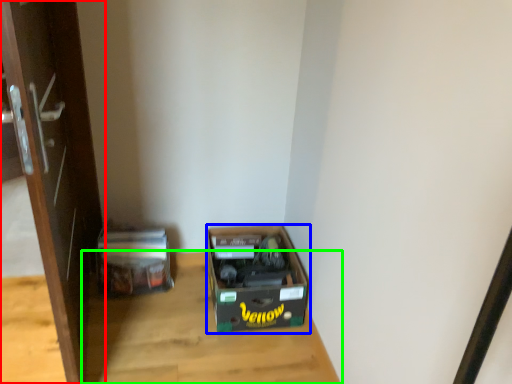
Question: Which is farther away from door (highlighted by a red box)? box (highlighted by a blue box) or table (highlighted by a green box)?

Choices:
 (A) box
 (B) table

Answer: (A)